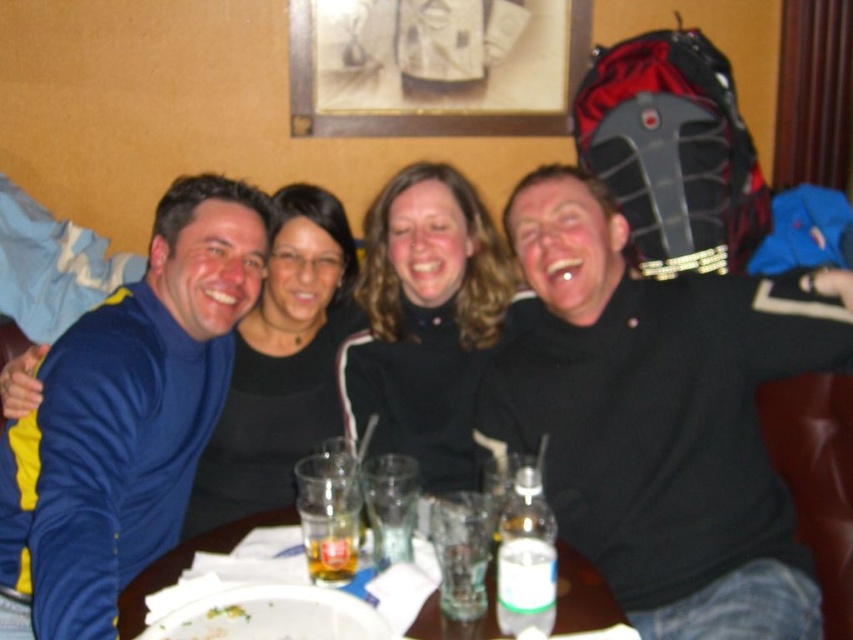
You are a barista who needs to place a small coffee cup between the black textured sweater at right and the blue fleece jacket at left. Based on their sizes, which object should the cup be closer to?

The black textured sweater at right occupies less space than the blue fleece jacket at left, so the cup should be placed closer to the black textured sweater at right to ensure there is enough space between them.

You are a server in a restaurant and need to deliver a tray of drinks to the table. The tray is 24 inches wide. Can you place it between the black textured sweater at right and the transparent glassware at center without moving any existing items?

The distance between the black textured sweater at right and the transparent glassware at center is 25.90 inches. Since the tray is 24 inches wide, it can fit within the available space.